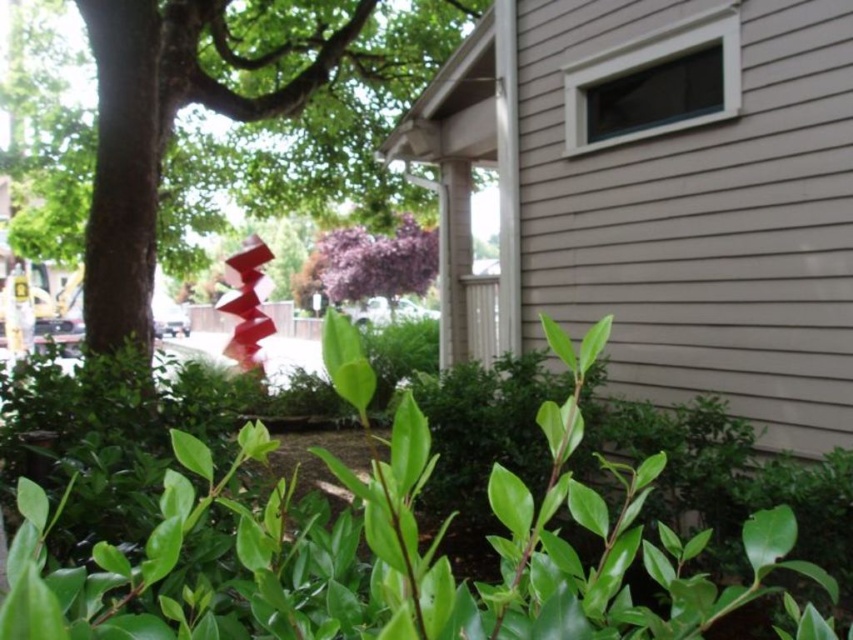
Question: Does green leafy tree at center lie behind purple matte flower at center?

Choices:
 (A) no
 (B) yes

Answer: (A)

Question: Which of the following is the closest to the observer?

Choices:
 (A) (624, 538)
 (B) (216, 112)

Answer: (A)

Question: Does green glossy hedge at lower center appear on the right side of green leafy tree at center?

Choices:
 (A) no
 (B) yes

Answer: (B)

Question: Which point is farther to the camera?

Choices:
 (A) green glossy hedge at lower center
 (B) purple matte flower at center

Answer: (B)

Question: Which point appears farthest from the camera in this image?

Choices:
 (A) (202, 611)
 (B) (419, 288)
 (C) (112, 266)

Answer: (B)

Question: Can you confirm if green glossy hedge at lower center is wider than green leafy tree at center?

Choices:
 (A) yes
 (B) no

Answer: (A)